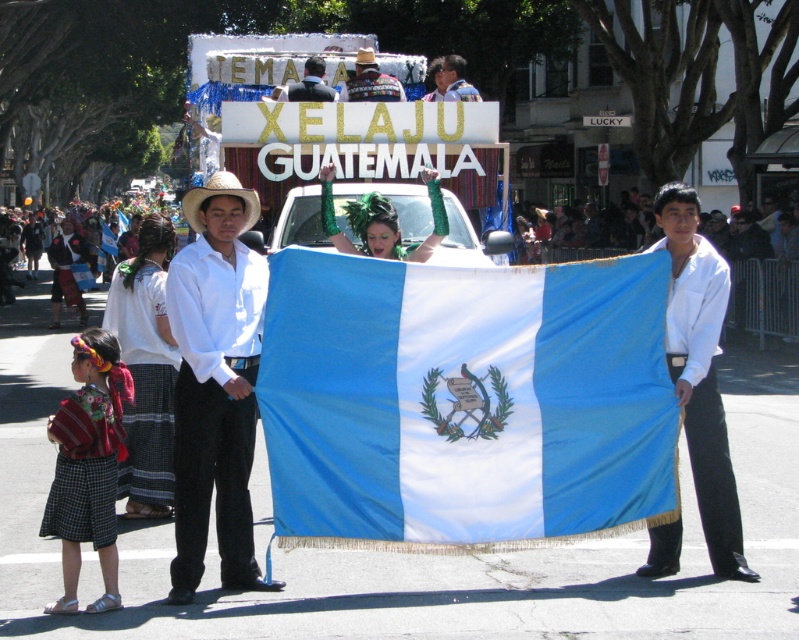
Does point (376, 72) come behind point (309, 93)?

Yes, point (376, 72) is farther from viewer.

Who is lower down, knitted sweater at center or matte black suit at upper center?

matte black suit at upper center is lower down.

The width and height of the screenshot is (799, 640). Identify the location of knitted sweater at center. pyautogui.click(x=370, y=81).

Consider the image. Between knitted sweater at center and matte white shirt at center, which one appears on the left side from the viewer's perspective?

knitted sweater at center

Between point (400, 99) and point (460, 92), which one is positioned behind?

The point (460, 92) is behind.

Where is `knitted sweater at center`? The width and height of the screenshot is (799, 640). knitted sweater at center is located at coordinates (370, 81).

Can you confirm if white smooth shirt at center is thinner than shiny green costume at center?

Yes.

Is white smooth shirt at center positioned before shiny green costume at center?

Yes, it is.

Who is more distant from viewer, (x=736, y=496) or (x=372, y=216)?

Point (x=372, y=216)

Find the location of a particular element. This screenshot has height=640, width=799. white smooth shirt at center is located at coordinates (700, 371).